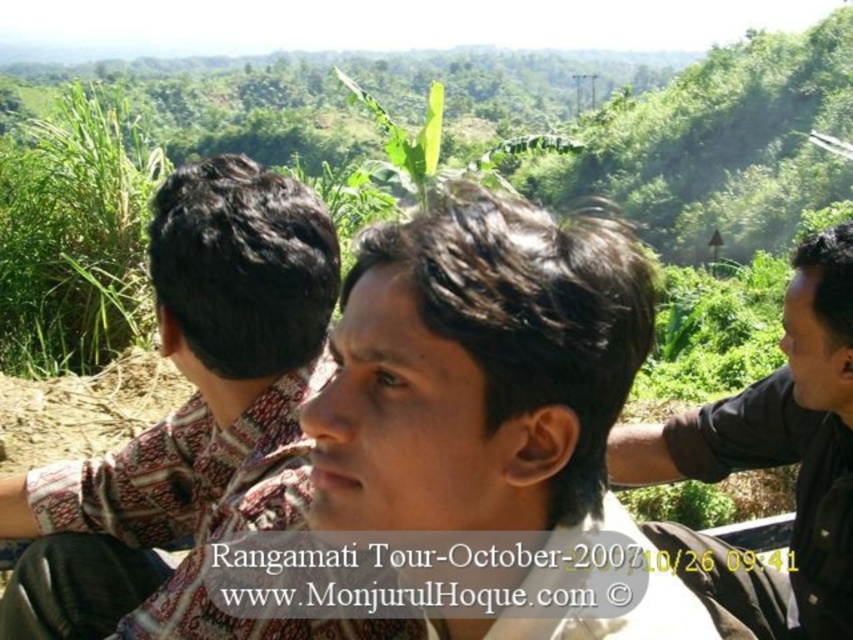
Question: Does green leafy plant at center appear on the right side of brown woven shirt at left?

Choices:
 (A) yes
 (B) no

Answer: (B)

Question: Which object is farther from the camera taking this photo?

Choices:
 (A) brown woven shirt at left
 (B) black matte shirt at right
 (C) brown printed shirt at center

Answer: (B)

Question: Which point is farther to the camera?

Choices:
 (A) (788, 48)
 (B) (798, 445)
 (C) (465, 403)
 (D) (318, 240)

Answer: (A)

Question: Which of these objects is positioned closest to the brown printed shirt at center?

Choices:
 (A) green leafy plant at center
 (B) brown woven shirt at left

Answer: (B)

Question: Is green leafy plant at center thinner than black matte shirt at right?

Choices:
 (A) no
 (B) yes

Answer: (A)

Question: Observing the image, what is the correct spatial positioning of brown woven shirt at left in reference to black matte shirt at right?

Choices:
 (A) below
 (B) above

Answer: (A)